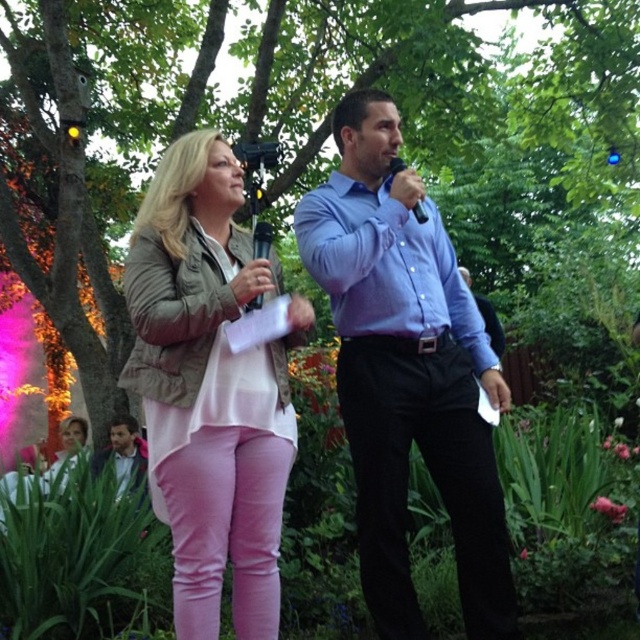
Question: Which point is farther to the camera?

Choices:
 (A) light brown leather jacket at lower left
 (B) pink matte pants at center
 (C) black matte microphone at center

Answer: (A)

Question: Does black plastic microphone at center come behind black matte microphone at center?

Choices:
 (A) no
 (B) yes

Answer: (A)

Question: Which object is positioned farthest from the pink matte pants at center?

Choices:
 (A) blue cotton shirt at center
 (B) black plastic microphone at center
 (C) light brown leather jacket at lower left

Answer: (C)

Question: Where is black plastic microphone at center located in relation to black matte microphone at center in the image?

Choices:
 (A) below
 (B) above

Answer: (A)

Question: From the image, what is the correct spatial relationship of blue cotton shirt at center in relation to pink matte pants at center?

Choices:
 (A) above
 (B) below

Answer: (A)

Question: Among these objects, which one is nearest to the camera?

Choices:
 (A) black matte microphone at center
 (B) blue cotton shirt at center
 (C) pink matte pants at center

Answer: (C)